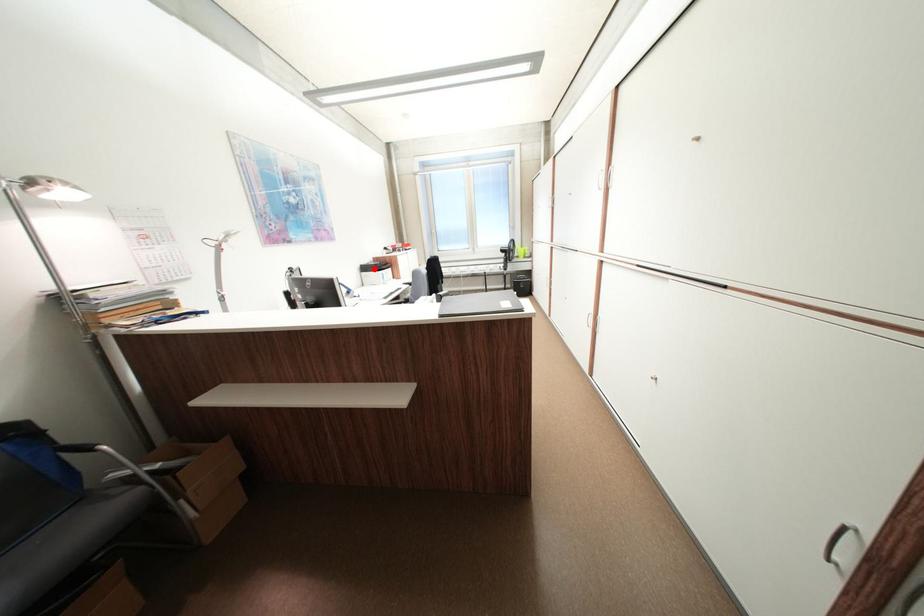
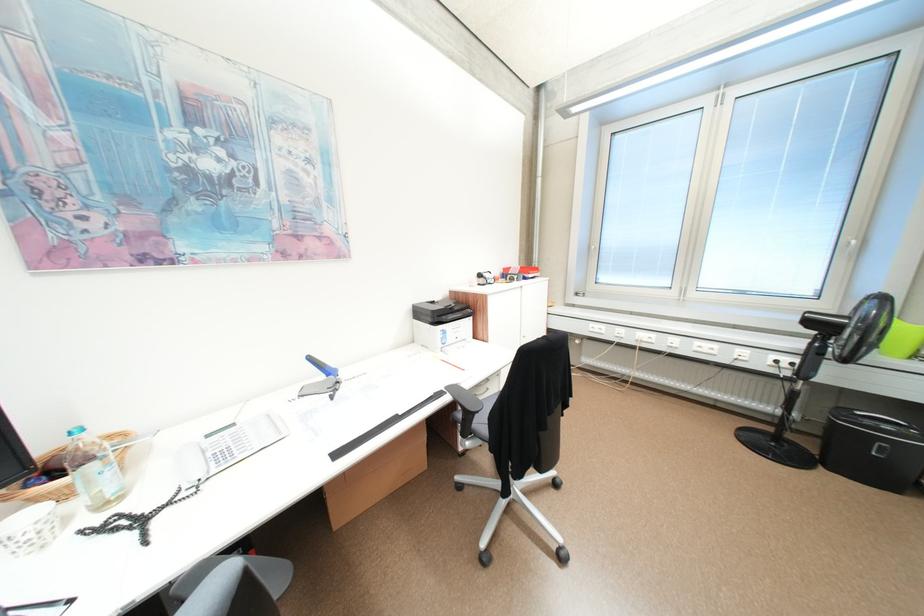
Question: I am providing you with two images of the same scene from different viewpoints. In image1, a red point is highlighted. Considering the same 3D point in image2, which of the following is correct?

Choices:
 (A) It is closer
 (B) It is farther

Answer: (B)